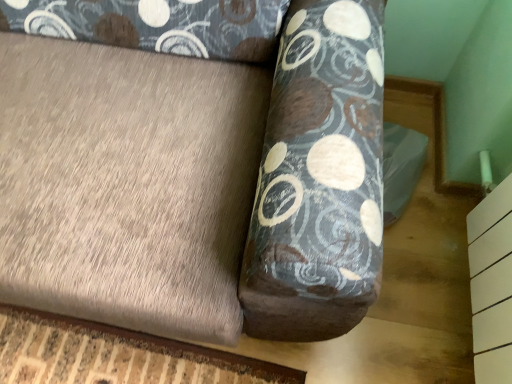
The height and width of the screenshot is (384, 512). Describe the element at coordinates (198, 182) in the screenshot. I see `brown fabric couch at center` at that location.

The height and width of the screenshot is (384, 512). Find the location of `brown fabric couch at center`. brown fabric couch at center is located at coordinates (198, 182).

Locate an element on the screen. The height and width of the screenshot is (384, 512). brown fabric couch at center is located at coordinates (198, 182).